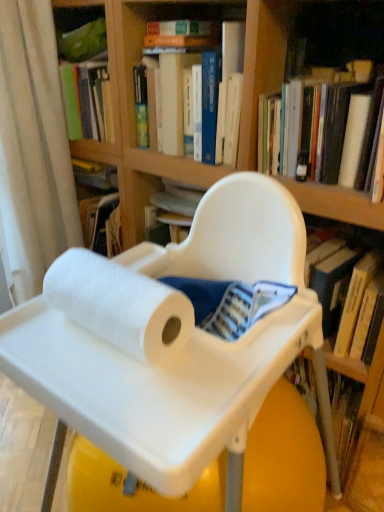
Question: Is white plastic tray at center located outside white paper towel at center?

Choices:
 (A) yes
 (B) no

Answer: (A)

Question: Considering the relative sizes of white plastic tray at center and white paper towel at center in the image provided, is white plastic tray at center smaller than white paper towel at center?

Choices:
 (A) no
 (B) yes

Answer: (A)

Question: Is white plastic tray at center closer to the viewer compared to white paper towel at center?

Choices:
 (A) yes
 (B) no

Answer: (A)

Question: Is white plastic tray at center next to white paper towel at center and touching it?

Choices:
 (A) no
 (B) yes

Answer: (A)

Question: Can you confirm if white plastic tray at center is shorter than white paper towel at center?

Choices:
 (A) no
 (B) yes

Answer: (A)

Question: Can you confirm if white plastic tray at center is wider than white paper towel at center?

Choices:
 (A) yes
 (B) no

Answer: (A)

Question: Can you confirm if white matte book at upper right, acting as the 2th book starting from the left, is positioned to the left of blue hardcover book at upper center, the 2th book positioned from the right?

Choices:
 (A) no
 (B) yes

Answer: (A)

Question: From the image's perspective, is white matte book at upper right, acting as the 2th book starting from the left, beneath blue hardcover book at upper center, the 2th book positioned from the right?

Choices:
 (A) no
 (B) yes

Answer: (B)

Question: Does white matte book at upper right, which is counted as the 1th book, starting from the right, have a lesser height compared to blue hardcover book at upper center, which ranks as the first book in left-to-right order?

Choices:
 (A) no
 (B) yes

Answer: (B)

Question: Is white matte book at upper right, acting as the 2th book starting from the left, oriented away from blue hardcover book at upper center, the 2th book positioned from the right?

Choices:
 (A) yes
 (B) no

Answer: (B)

Question: From the image's perspective, is white matte book at upper right, acting as the 2th book starting from the left, over blue hardcover book at upper center, which ranks as the first book in left-to-right order?

Choices:
 (A) yes
 (B) no

Answer: (B)

Question: Is white matte book at upper right, which is counted as the 1th book, starting from the right, smaller than blue hardcover book at upper center, which ranks as the first book in left-to-right order?

Choices:
 (A) no
 (B) yes

Answer: (B)

Question: Is white plastic tray at center outside of white fabric curtain at left?

Choices:
 (A) no
 (B) yes

Answer: (B)